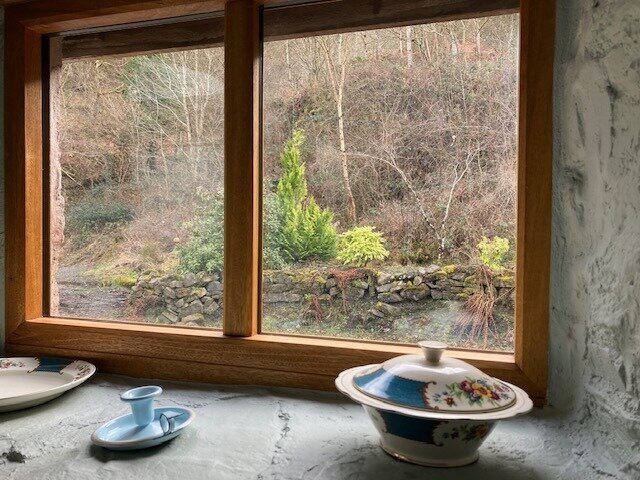
The width and height of the screenshot is (640, 480). I want to click on white candle stick, so click(145, 392).